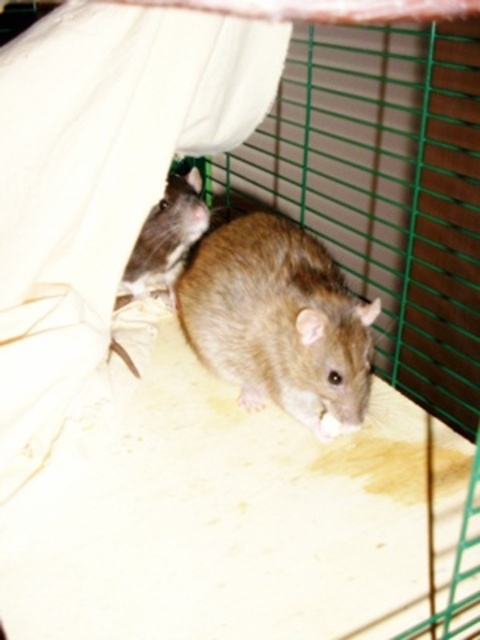
You are a small animal that needs to move from the shiny brown fur at upper left to the brown furry hamster at center. Given that your maximum jumping distance is 30 centimeters, can you safely make the jump?

The distance between the shiny brown fur at upper left and the brown furry hamster at center is 31.02 centimeters, which exceeds your maximum jumping distance of 30 centimeters. Therefore, you cannot safely make the jump.

Consider the image. You are a small animal trying to reach the shiny brown fur at upper left from the brown furry hamster at center. Which direction should you move to get closer?

The brown furry hamster at center is already closer to the viewer than the shiny brown fur at upper left. To reach the shiny brown fur at upper left, you should move towards the upper left direction away from the viewer.